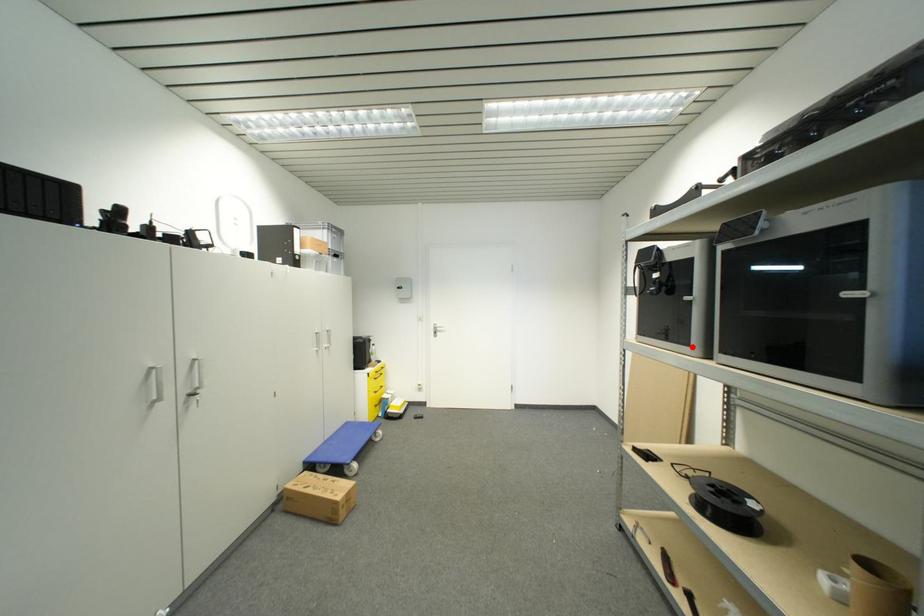
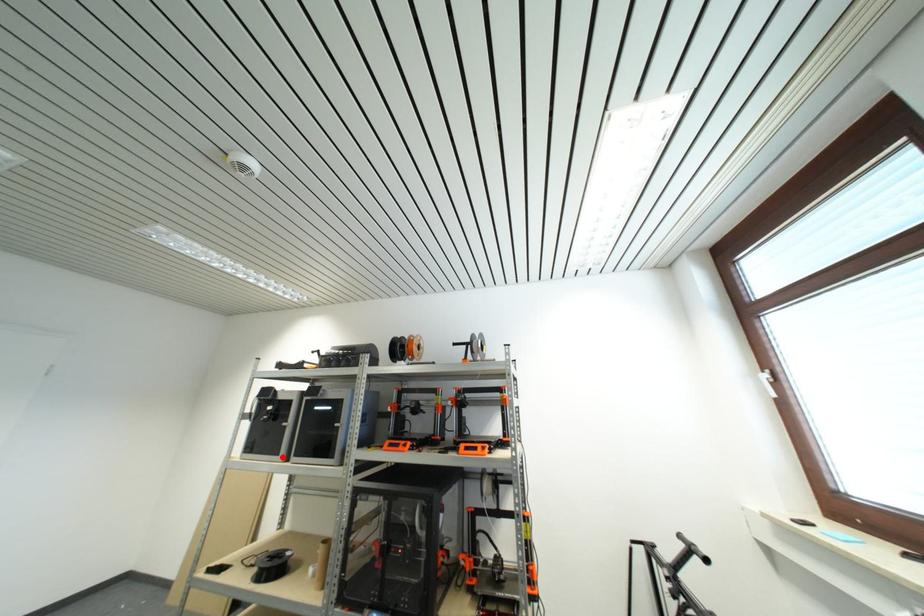
I am providing you with two images of the same scene from different viewpoints. A red point is marked on the first image and another point is marked on the second image. Do the highlighted points in image1 and image2 indicate the same real-world spot?

Yes